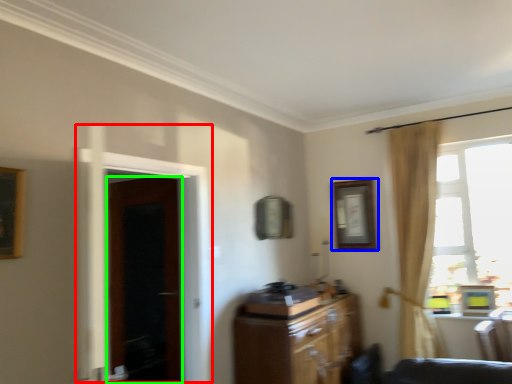
Question: Considering the real-world distances, which object is farthest from screen door (highlighted by a red box)? picture frame (highlighted by a blue box) or door (highlighted by a green box)?

Choices:
 (A) picture frame
 (B) door

Answer: (A)